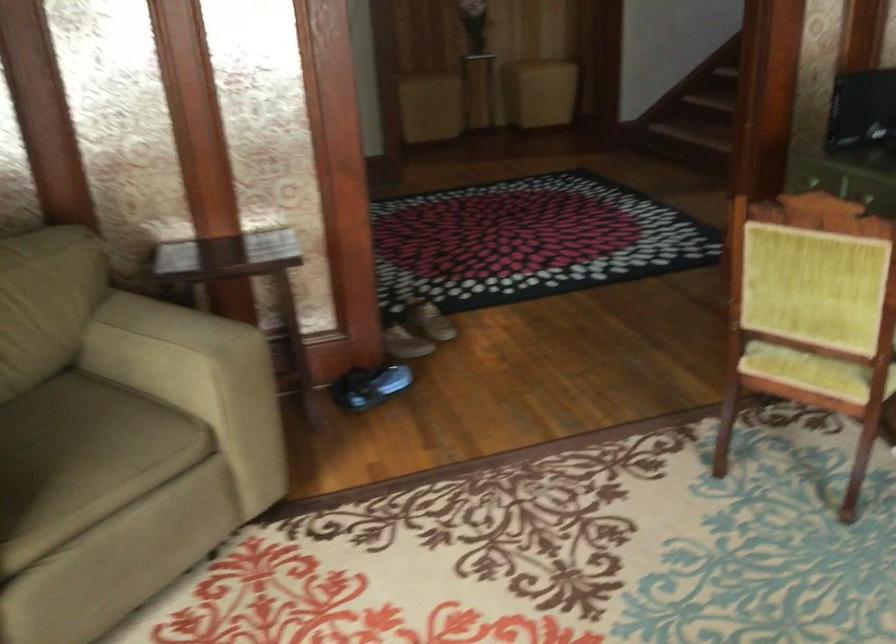
At what (x,y) coordinates should I click in order to perform the action: click on blue shoe. Please return your answer as a coordinate pair (x, y). The width and height of the screenshot is (896, 644). Looking at the image, I should click on (369, 386).